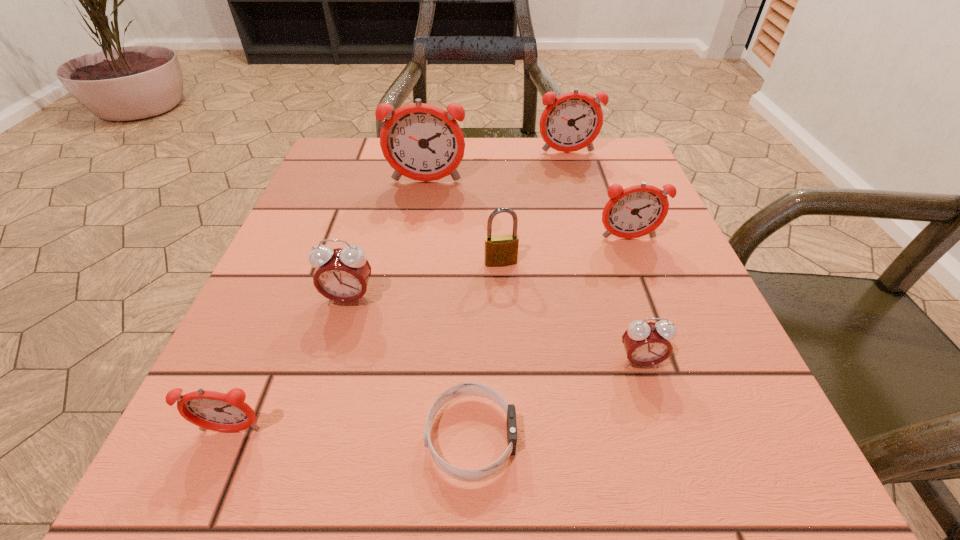
Locate an element on the screen. free point between the second farthest reddish-pink alarm clock and the wristband is located at coordinates (448, 309).

Locate an element on the screen. The width and height of the screenshot is (960, 540). vacant area between the third farthest alarm clock and the fourth nearest object is located at coordinates (489, 269).

In order to click on free spot between the fifth farthest alarm clock and the third nearest alarm clock in this screenshot , I will do `click(494, 330)`.

Locate an element on the screen. The width and height of the screenshot is (960, 540). vacant region between the tallest alarm clock and the brass padlock is located at coordinates (464, 222).

Find the location of a particular element. This screenshot has width=960, height=540. vacant region between the second farthest object and the shortest object is located at coordinates (448, 309).

Where is `blank region between the tallest alarm clock and the nearest reddish-pink alarm clock`? This screenshot has width=960, height=540. blank region between the tallest alarm clock and the nearest reddish-pink alarm clock is located at coordinates [x=328, y=306].

Where is `object that is the nearest to the fifth shortest alarm clock`? object that is the nearest to the fifth shortest alarm clock is located at coordinates (423, 142).

You are a GUI agent. You are given a task and a screenshot of the screen. Output one action in this format:
    pyautogui.click(x=<x>, y=<y>)
    Task: Click on the object identified as the sixth closest to the second smallest reddish-pink alarm clock
    The image size is (960, 540).
    Given the screenshot: What is the action you would take?
    pyautogui.click(x=342, y=275)

Find the location of a particular element. alarm clock that can be found as the closest to the leftmost reddish-pink alarm clock is located at coordinates (342, 275).

This screenshot has width=960, height=540. I want to click on alarm clock identified as the fifth closest to the fifth shortest alarm clock, so click(212, 410).